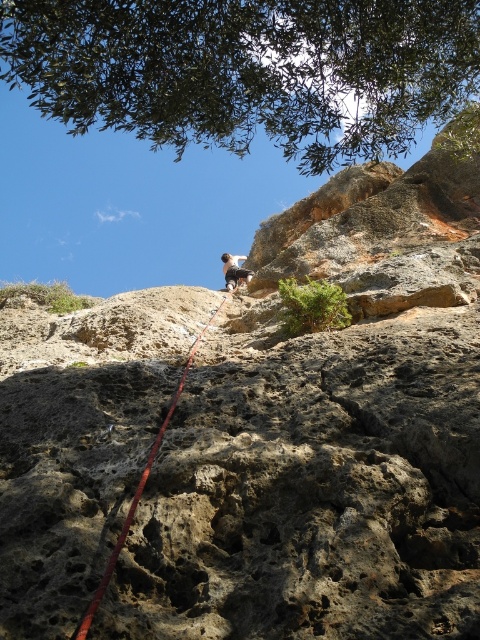
Is point (189, 364) behind point (228, 282)?

No, it is in front of (228, 282).

Locate an element on the screen. red nylon rope at center is located at coordinates (140, 490).

Which is behind, point (113, 566) or point (224, 259)?

Positioned behind is point (224, 259).

Locate an element on the screen. red nylon rope at center is located at coordinates (140, 490).

Can you confirm if green leafy tree at upper center is positioned to the left of red nylon rope at center?

Incorrect, green leafy tree at upper center is not on the left side of red nylon rope at center.

Is point (85, 122) behind point (136, 500)?

That is True.

Locate an element on the screen. The height and width of the screenshot is (640, 480). green leafy tree at upper center is located at coordinates (248, 70).

Is point (274, 51) positioned behind point (230, 275)?

No, it is in front of (230, 275).

Between point (420, 86) and point (240, 269), which one is positioned in front?

Point (420, 86) is in front.

Is point (327, 118) less distant than point (232, 288)?

Yes, point (327, 118) is in front of point (232, 288).

Image resolution: width=480 pixels, height=640 pixels. What are the coordinates of `green leafy tree at upper center` in the screenshot? It's located at click(x=248, y=70).